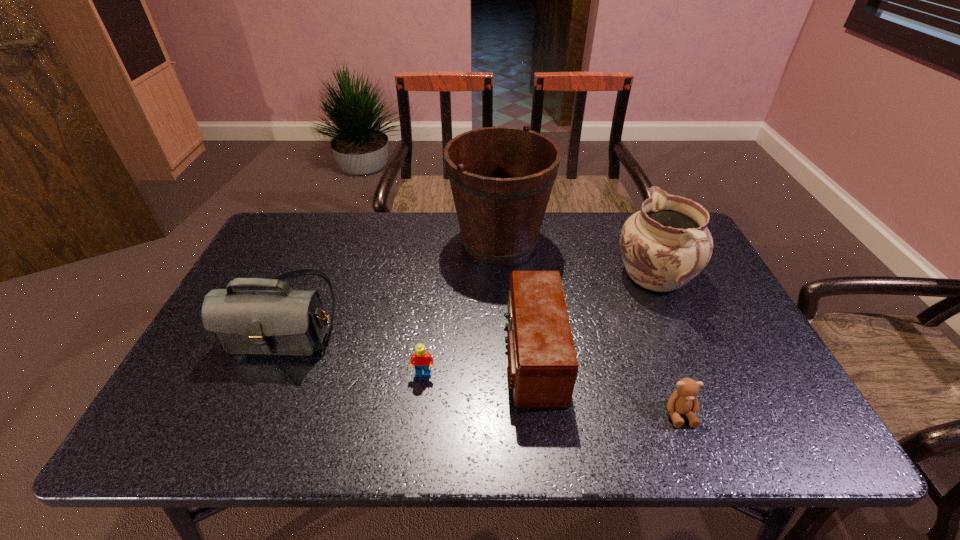
Locate an element on the screen. object situated at the far right corner is located at coordinates (666, 244).

The height and width of the screenshot is (540, 960). I want to click on free space at the far edge of the desktop, so click(x=415, y=230).

This screenshot has height=540, width=960. Find the location of `free space at the near edge`. free space at the near edge is located at coordinates (487, 436).

Identify the location of free space at the left edge of the desktop. (221, 400).

This screenshot has height=540, width=960. I want to click on free space at the right edge of the desktop, so click(x=712, y=368).

Locate an element on the screen. free point at the far left corner is located at coordinates (276, 233).

I want to click on vacant space at the near left corner of the desktop, so click(x=208, y=412).

In order to click on free space between the teddy bear and the leftmost object in this screenshot , I will do `click(484, 364)`.

Image resolution: width=960 pixels, height=540 pixels. What are the coordinates of `free area in between the shoulder bag and the pitcher` in the screenshot? It's located at (472, 296).

Find the location of a particular element. unoccupied position between the teddy bear and the bucket is located at coordinates (589, 327).